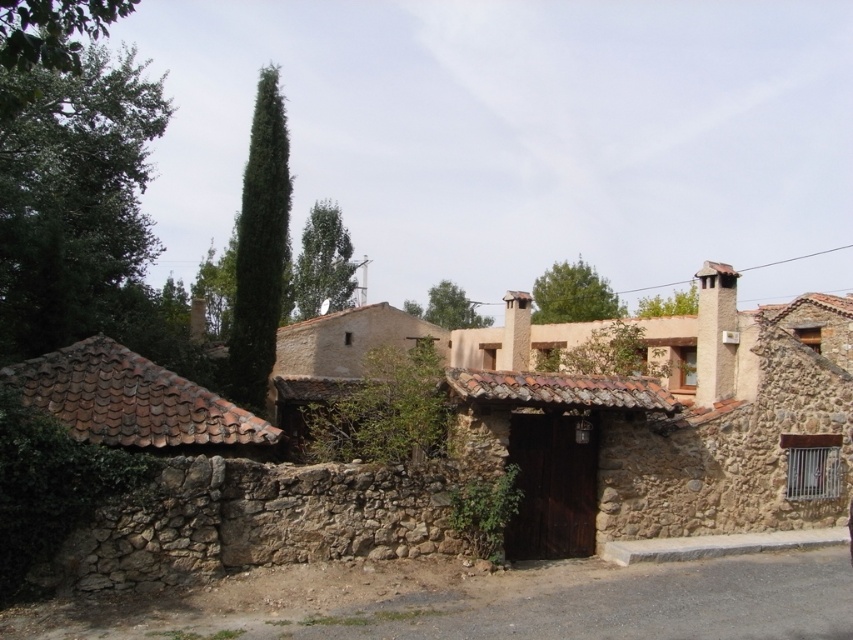
Question: Does brown stone wall at center appear over green leafy cypress at upper center?

Choices:
 (A) no
 (B) yes

Answer: (A)

Question: Is brown stone wall at center to the right of green leafy cypress at upper center from the viewer's perspective?

Choices:
 (A) no
 (B) yes

Answer: (B)

Question: Which of the following is the farthest from the observer?

Choices:
 (A) green leafy cypress at upper center
 (B) brown stone wall at center

Answer: (A)

Question: Does brown stone wall at center appear on the left side of green leafy cypress at upper center?

Choices:
 (A) no
 (B) yes

Answer: (A)